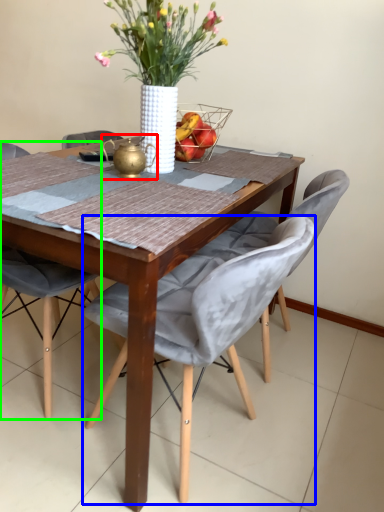
Question: Estimate the real-world distances between objects in this image. Which object is farther from tea pot (highlighted by a red box), chair (highlighted by a blue box) or chair (highlighted by a green box)?

Choices:
 (A) chair
 (B) chair

Answer: (B)